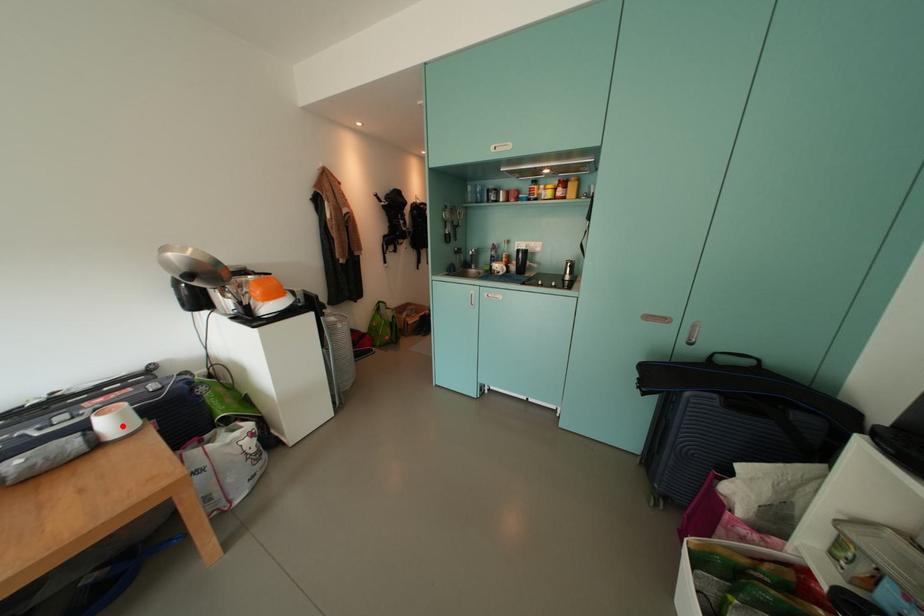
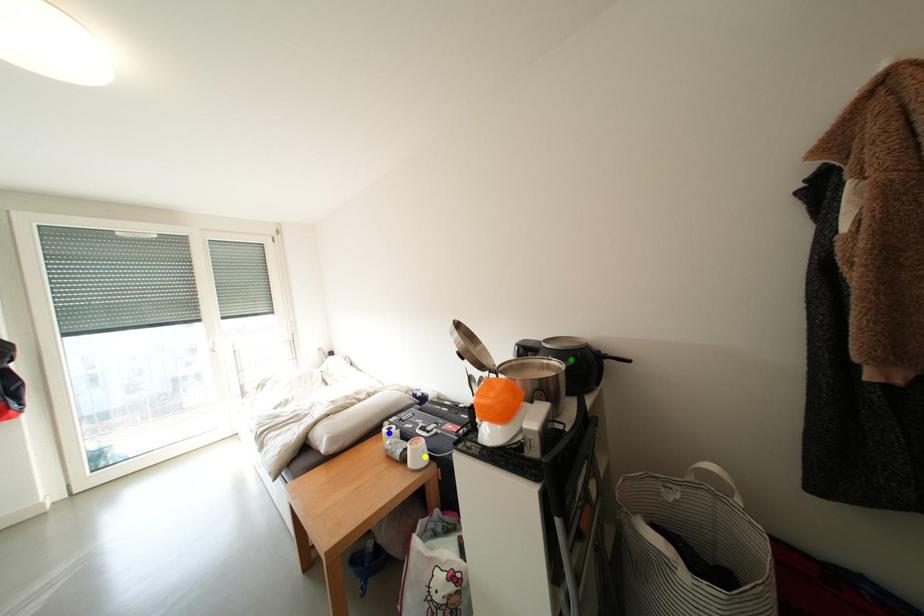
Question: I am providing you with two images of the same scene from different viewpoints. A red point is marked on the first image. You are given multiple points on the second image. Which point in image 2 represents the same 3d spot as the red point in image 1?

Choices:
 (A) blue point
 (B) green point
 (C) yellow point

Answer: (C)